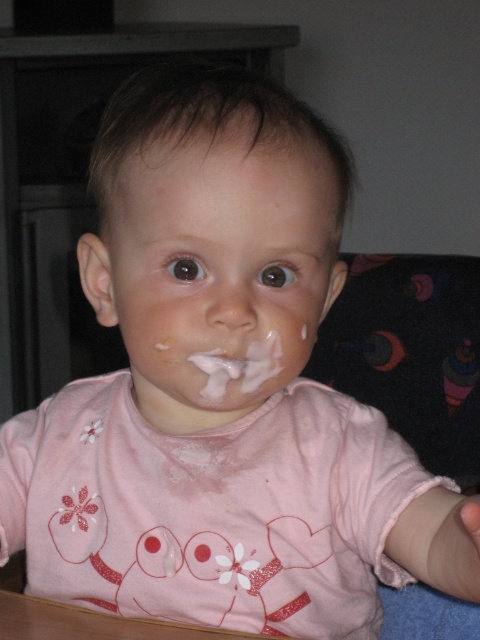
Question: Which object appears farthest from the camera in this image?

Choices:
 (A) white creamy frosting at mouth
 (B) white matte face at center

Answer: (A)

Question: Is white matte face at center to the right of white creamy frosting at mouth from the viewer's perspective?

Choices:
 (A) no
 (B) yes

Answer: (A)

Question: Which point appears farthest from the camera in this image?

Choices:
 (A) (134, 211)
 (B) (268, 369)

Answer: (B)

Question: Considering the relative positions of white matte face at center and white creamy frosting at mouth in the image provided, where is white matte face at center located with respect to white creamy frosting at mouth?

Choices:
 (A) below
 (B) above

Answer: (B)

Question: Does white matte face at center appear over white creamy frosting at mouth?

Choices:
 (A) yes
 (B) no

Answer: (A)

Question: Among these objects, which one is farthest from the camera?

Choices:
 (A) white creamy frosting at mouth
 (B) white matte face at center

Answer: (A)